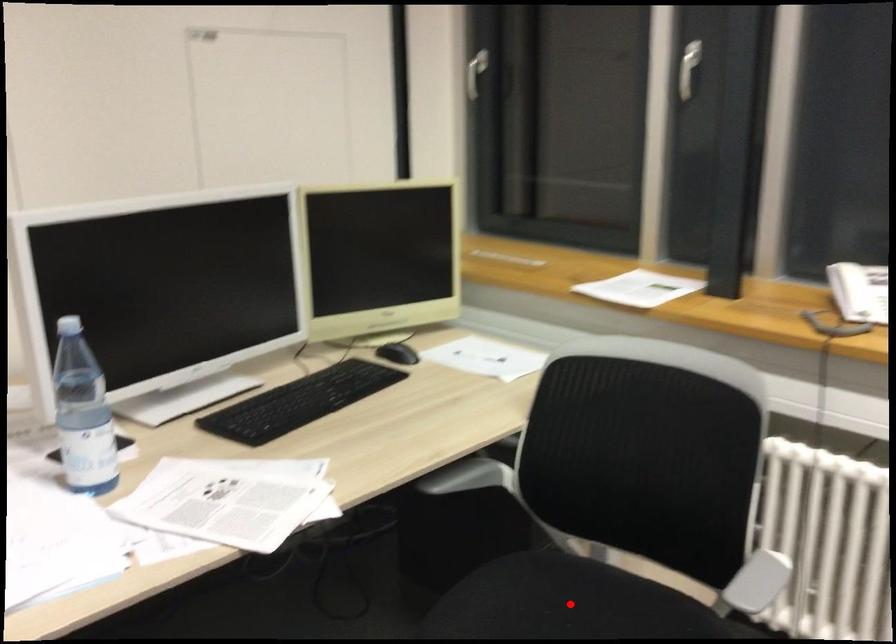
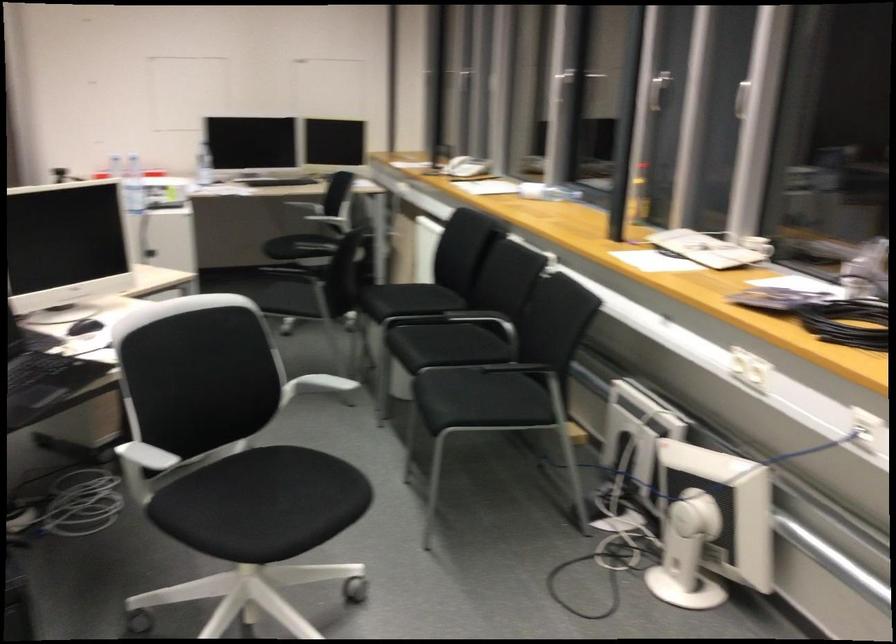
Question: I am providing you with two images of the same scene from different viewpoints. Image1 has a red point marked. In image2, the corresponding 3D location appears at what relative position? Reply with the corresponding letter.

Choices:
 (A) Closer
 (B) Farther

Answer: (B)